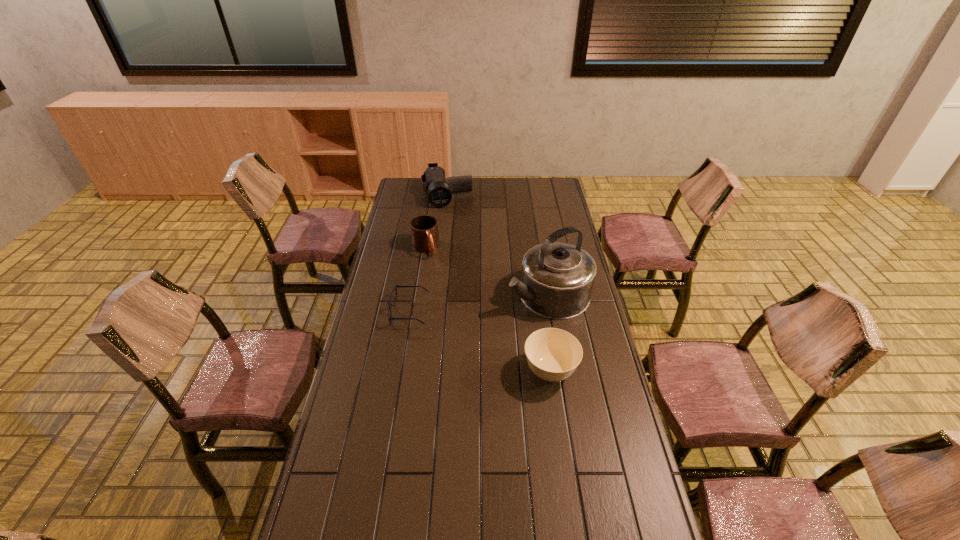
At what (x,y) coordinates should I click in order to perform the action: click on vacant space that's between the nearest object and the farthest object. Please return your answer as a coordinate pair (x, y). The height and width of the screenshot is (540, 960). Looking at the image, I should click on (498, 282).

Where is `free point between the kettle and the camcorder`? free point between the kettle and the camcorder is located at coordinates (497, 244).

Find the location of a particular element. The width and height of the screenshot is (960, 540). free point between the tallest object and the farthest object is located at coordinates (497, 244).

Where is `vacant space in between the tallest object and the shortest object`? Image resolution: width=960 pixels, height=540 pixels. vacant space in between the tallest object and the shortest object is located at coordinates (478, 303).

You are a GUI agent. You are given a task and a screenshot of the screen. Output one action in this format:
    pyautogui.click(x=<x>, y=<y>)
    Task: Click on the free area in between the kettle and the mug
    
    Given the screenshot: What is the action you would take?
    pyautogui.click(x=487, y=272)

At what (x,y) coordinates should I click in order to perform the action: click on free point between the spectacles and the second farthest object. Please return your answer as a coordinate pair (x, y). Image resolution: width=960 pixels, height=540 pixels. Looking at the image, I should click on tap(417, 280).

Where is `unoccupied position between the sugar bowl and the shortest object`? This screenshot has height=540, width=960. unoccupied position between the sugar bowl and the shortest object is located at coordinates (479, 341).

Where is `vacant space in between the sugar bowl and the mug`? The height and width of the screenshot is (540, 960). vacant space in between the sugar bowl and the mug is located at coordinates (488, 310).

Where is `object that ranks as the closest to the sugar bowl`? object that ranks as the closest to the sugar bowl is located at coordinates (557, 279).

Find the location of a particular element. the closest object to the sugar bowl is located at coordinates (557, 279).